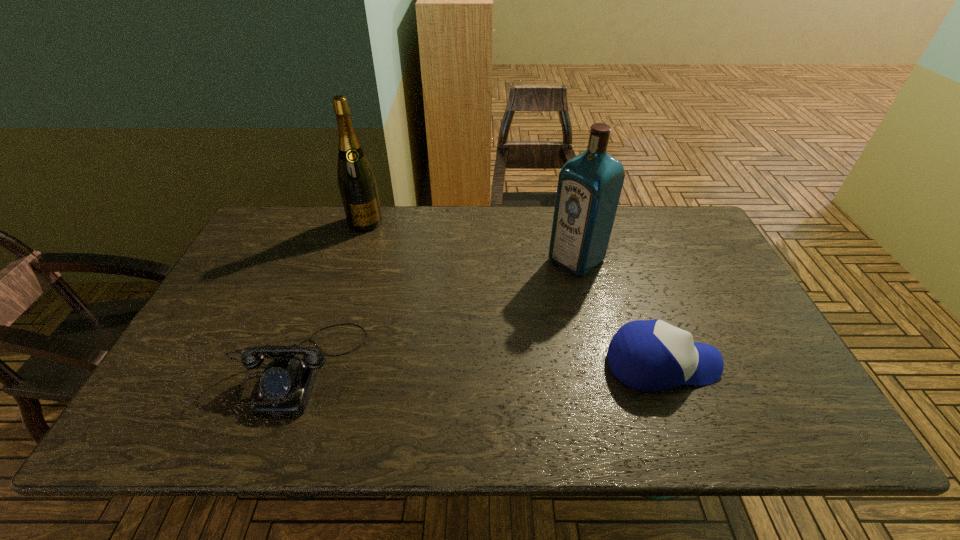
The width and height of the screenshot is (960, 540). I want to click on telephone, so click(x=286, y=383).

Locate an element on the screen. The height and width of the screenshot is (540, 960). baseball cap is located at coordinates (648, 355).

You are a GUI agent. You are given a task and a screenshot of the screen. Output one action in this format:
    pyautogui.click(x=<x>, y=<y>)
    Task: Click on the second farthest object
    This screenshot has height=540, width=960.
    Given the screenshot: What is the action you would take?
    pyautogui.click(x=589, y=186)

This screenshot has width=960, height=540. I want to click on the farthest object, so [356, 181].

The height and width of the screenshot is (540, 960). Identify the location of vacant point located on the flat label side of the third nearest object. (475, 337).

Where is `vacant space located 0.170m on the flat label side of the third nearest object`? The width and height of the screenshot is (960, 540). vacant space located 0.170m on the flat label side of the third nearest object is located at coordinates (520, 303).

Find the location of a particular element. vacant space located on the flat label side of the third nearest object is located at coordinates (539, 288).

This screenshot has width=960, height=540. In order to click on free space located on the front-facing side of the wine bottle in this screenshot , I will do `click(374, 242)`.

The height and width of the screenshot is (540, 960). What are the coordinates of `vacant space situated on the front-facing side of the wine bottle` in the screenshot? It's located at (392, 282).

Image resolution: width=960 pixels, height=540 pixels. What are the coordinates of `vacant space located on the front-facing side of the wine bottle` in the screenshot? It's located at (385, 265).